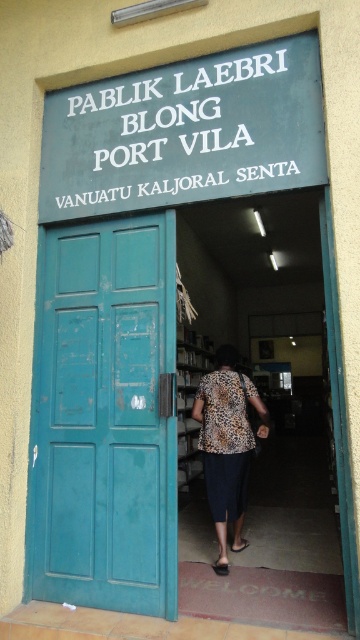
Question: From the image, what is the correct spatial relationship of green painted signboard at upper center in relation to matte wood bookshelf at center?

Choices:
 (A) below
 (B) above

Answer: (B)

Question: Can you confirm if leopard print blouse at center is bigger than matte wood bookshelf at center?

Choices:
 (A) yes
 (B) no

Answer: (B)

Question: Which of the following is the closest to the observer?

Choices:
 (A) leopard print blouse at center
 (B) green painted signboard at upper center
 (C) matte wood bookshelf at center

Answer: (B)

Question: Among these objects, which one is nearest to the camera?

Choices:
 (A) leopard print blouse at center
 (B) matte wood bookshelf at center

Answer: (A)

Question: Is teal matte door at left bigger than green painted signboard at upper center?

Choices:
 (A) yes
 (B) no

Answer: (A)

Question: Which of these objects is positioned closest to the leopard print blouse at center?

Choices:
 (A) teal matte door at left
 (B) green painted signboard at upper center
 (C) matte wood bookshelf at center

Answer: (A)